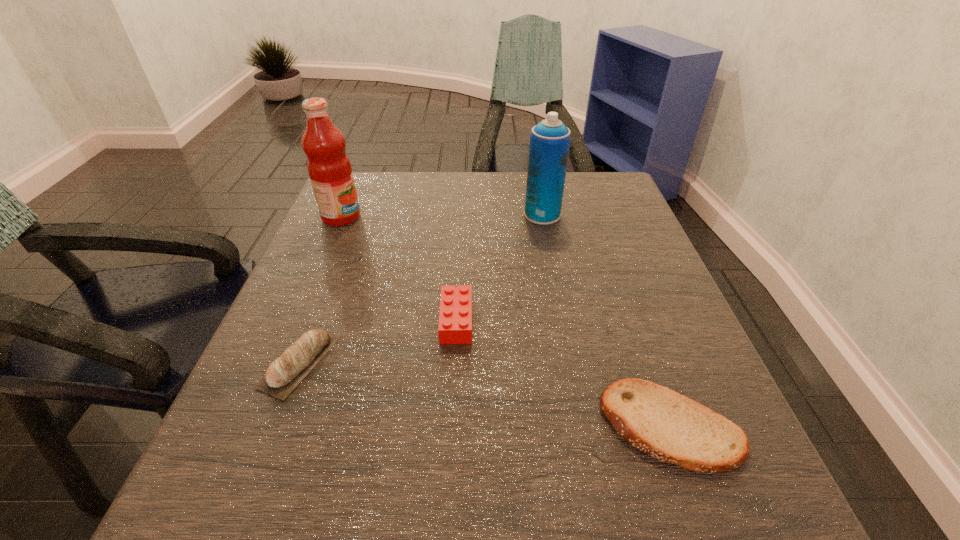
Locate an element on the screen. Image resolution: width=960 pixels, height=540 pixels. fruit juice that is at the far edge is located at coordinates (329, 168).

The image size is (960, 540). I want to click on aerosol can positioned at the far edge, so click(550, 139).

Identify the location of object present at the near edge. (668, 426).

Locate an element on the screen. The image size is (960, 540). fruit juice located in the left edge section of the desktop is located at coordinates click(329, 168).

Identify the location of pita bread present at the left edge. (281, 378).

Locate an element on the screen. object that is at the right edge is located at coordinates point(668,426).

Locate an element on the screen. The image size is (960, 540). object at the far left corner is located at coordinates (329, 168).

You are a GUI agent. You are given a task and a screenshot of the screen. Output one action in this format:
    pyautogui.click(x=<x>, y=<y>)
    Task: Click on the object that is at the near right corner
    This screenshot has height=540, width=960.
    Given the screenshot: What is the action you would take?
    pyautogui.click(x=668, y=426)

You are a GUI agent. You are given a task and a screenshot of the screen. Output one action in this format:
    pyautogui.click(x=<x>, y=<y>)
    Task: Click on the free location at the far edge
    The image size is (960, 540).
    Given the screenshot: What is the action you would take?
    pyautogui.click(x=472, y=177)

I want to click on vacant region at the near edge of the desktop, so click(x=519, y=531).